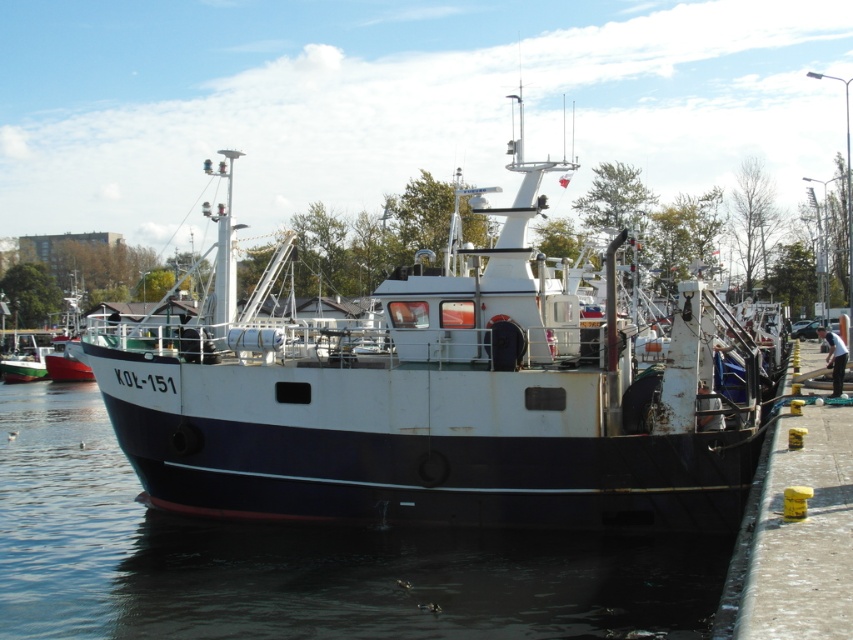
Does white matte boat at center have a smaller size compared to white matte boat at left?

No, white matte boat at center is not smaller than white matte boat at left.

Is white matte boat at center bigger than white matte boat at left?

Yes.

Is point (552, 496) closer to viewer compared to point (27, 353)?

Yes, point (552, 496) is in front of point (27, 353).

The width and height of the screenshot is (853, 640). Identify the location of white matte boat at center. (445, 401).

Who is positioned more to the right, blue matte water at center or white matte boat at left?

blue matte water at center is more to the right.

Is blue matte water at center wider than white matte boat at left?

Correct, the width of blue matte water at center exceeds that of white matte boat at left.

Who is more distant from viewer, (3, 410) or (12, 356)?

The point (12, 356) is more distant.

Identify the location of blue matte water at center. (296, 560).

Which is more to the right, white matte boat at center or blue matte water at center?

white matte boat at center

Can you confirm if white matte boat at center is bigger than blue matte water at center?

Correct, white matte boat at center is larger in size than blue matte water at center.

Between point (207, 352) and point (314, 584), which one is positioned behind?

The point (207, 352) is behind.

Identify the location of white matte boat at center. This screenshot has width=853, height=640. (445, 401).